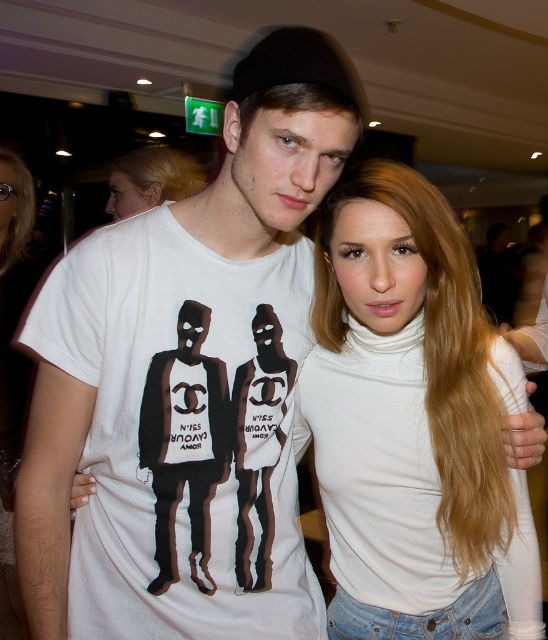
Question: Is white cotton t-shirt at center positioned at the back of white turtleneck at center?

Choices:
 (A) no
 (B) yes

Answer: (A)

Question: Does white cotton t-shirt at center appear on the right side of white turtleneck at center?

Choices:
 (A) yes
 (B) no

Answer: (B)

Question: Can you confirm if white cotton t-shirt at center is positioned above white turtleneck at center?

Choices:
 (A) yes
 (B) no

Answer: (B)

Question: Which point appears closest to the camera in this image?

Choices:
 (A) (393, 544)
 (B) (283, 308)

Answer: (B)

Question: Which point appears farthest from the camera in this image?

Choices:
 (A) (304, 554)
 (B) (368, 596)

Answer: (A)